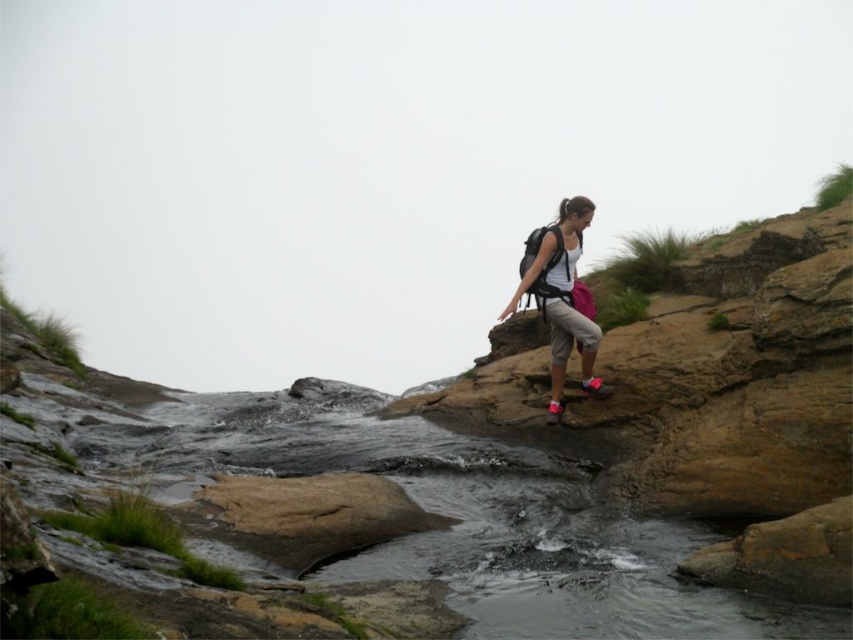
You are a hiker standing at the point labeled point (567, 346). You want to reach the stream located at the opposite side of the rocks. The rocks are uneven and slippery. If you can jump 10 meters, can you safely jump from your current position to the stream?

The distance between you and the stream is 10.40 meters. Since you can jump only 10 meters, you cannot safely jump the distance. You need to find another path.

You are the hiker in the scene. You need to retrieve your matte black backpack at upper right before continuing your hike. Which direction should you move relative to the clear water at center?

The clear water at center is to the left of the matte black backpack at upper right, so you should move to the right relative to the clear water at center to reach your matte black backpack at upper right.